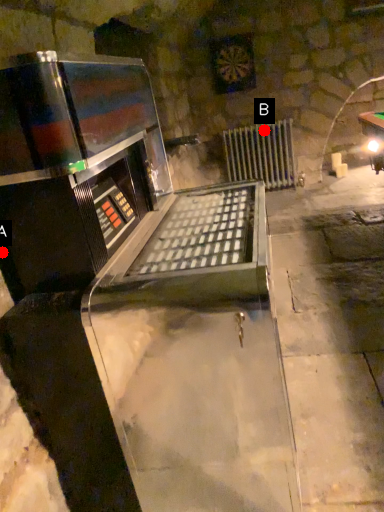
Question: Two points are circled on the image, labeled by A and B beside each circle. Which point is closer to the camera taking this photo?

Choices:
 (A) A is closer
 (B) B is closer

Answer: (A)